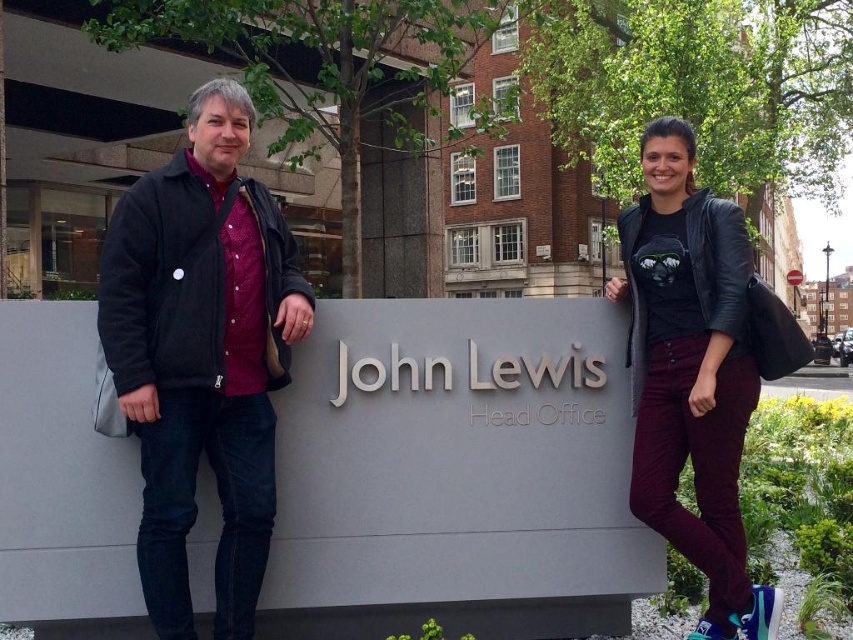
Does matte black jacket at left appear under black fleece jacket at left?

Correct, matte black jacket at left is located below black fleece jacket at left.

Is matte black jacket at left to the right of black fleece jacket at left from the viewer's perspective?

Correct, you'll find matte black jacket at left to the right of black fleece jacket at left.

Which is in front, point (136, 244) or point (215, 355)?

Positioned in front is point (136, 244).

You are a GUI agent. You are given a task and a screenshot of the screen. Output one action in this format:
    pyautogui.click(x=<x>, y=<y>)
    Task: Click on the matte black jacket at left
    This screenshot has height=640, width=853.
    Given the screenshot: What is the action you would take?
    pyautogui.click(x=196, y=355)

Is black fleece jacket at left closer to the viewer compared to black leather jacket at right?

Yes, it is in front of black leather jacket at right.

Is the position of black fleece jacket at left more distant than that of black leather jacket at right?

No, it is in front of black leather jacket at right.

Between point (178, 458) and point (730, 397), which one is positioned in front?

Point (178, 458)

This screenshot has width=853, height=640. Find the location of `black fleece jacket at left`. black fleece jacket at left is located at coordinates (202, 355).

Can you confirm if matte black jacket at left is positioned below black leather jacket at right?

No, matte black jacket at left is not below black leather jacket at right.

Is matte black jacket at left positioned before black leather jacket at right?

No, matte black jacket at left is further to the viewer.

Is point (102, 298) positioned behind point (689, 400)?

No.

At what (x,y) coordinates should I click in order to perform the action: click on matte black jacket at left. Please return your answer as a coordinate pair (x, y). The image size is (853, 640). Looking at the image, I should click on (196, 355).